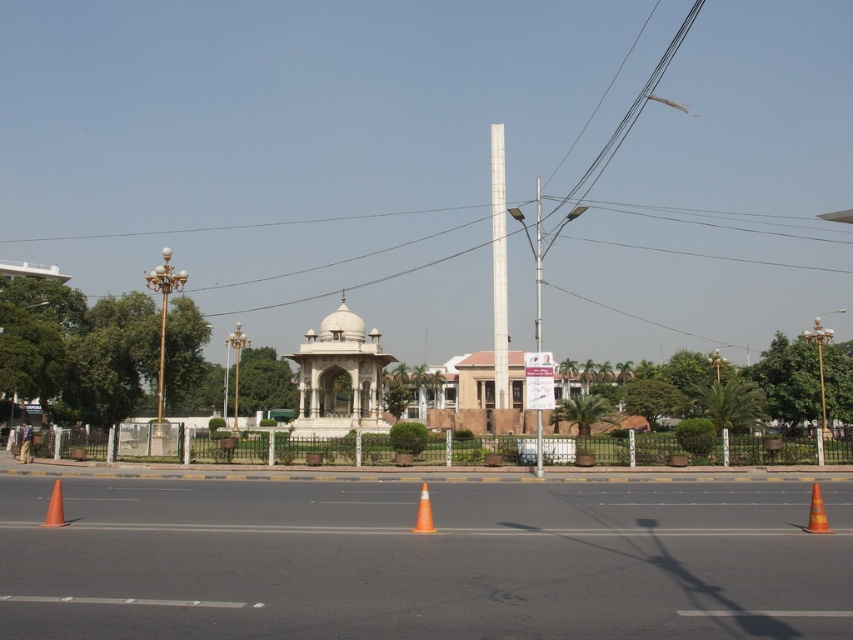
Is point (811, 493) positioned behind point (45, 512)?

That is False.

Is orange reflective cone at lower right above orange matte traffic cone at center?

Correct, orange reflective cone at lower right is located above orange matte traffic cone at center.

From the picture: Who is more forward, (811, 506) or (57, 509)?

Point (811, 506) is more forward.

Locate an element on the screen. orange reflective cone at lower right is located at coordinates (816, 513).

Does white marble gazebo at center have a lesser width compared to orange matte traffic cone at center?

Incorrect, white marble gazebo at center's width is not less than orange matte traffic cone at center's.

Does white marble gazebo at center have a greater width compared to orange matte traffic cone at center?

Correct, the width of white marble gazebo at center exceeds that of orange matte traffic cone at center.

Does point (300, 352) come farther from viewer compared to point (51, 512)?

Yes.

Where is `white marble gazebo at center`? This screenshot has height=640, width=853. white marble gazebo at center is located at coordinates (339, 378).

Is orange reflective cone at lower right to the left of orange reflective cone at center from the viewer's perspective?

In fact, orange reflective cone at lower right is to the right of orange reflective cone at center.

Where is `orange reflective cone at lower right`? The width and height of the screenshot is (853, 640). orange reflective cone at lower right is located at coordinates (x=816, y=513).